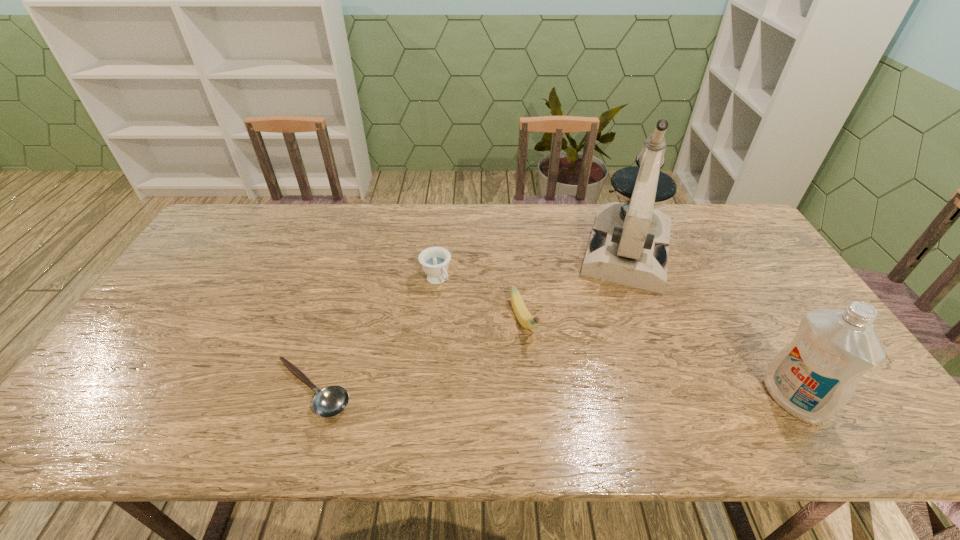
Identify the location of free space that satisfies the following two spatial constraints: 1. on the back side of the ladle; 2. on the right side of the teacup. The image size is (960, 540). (348, 280).

What are the coordinates of `free space in the image that satisfies the following two spatial constraints: 1. on the back side of the ladle; 2. on the left side of the third farthest object` in the screenshot? It's located at (334, 321).

At what (x,y) coordinates should I click in order to perform the action: click on free space that satisfies the following two spatial constraints: 1. on the front side of the rightmost object; 2. on the left side of the third nearest object. Please return your answer as a coordinate pair (x, y). The height and width of the screenshot is (540, 960). Looking at the image, I should click on (531, 399).

This screenshot has width=960, height=540. I want to click on vacant position in the image that satisfies the following two spatial constraints: 1. on the back side of the banana; 2. on the right side of the microscope, so click(x=516, y=251).